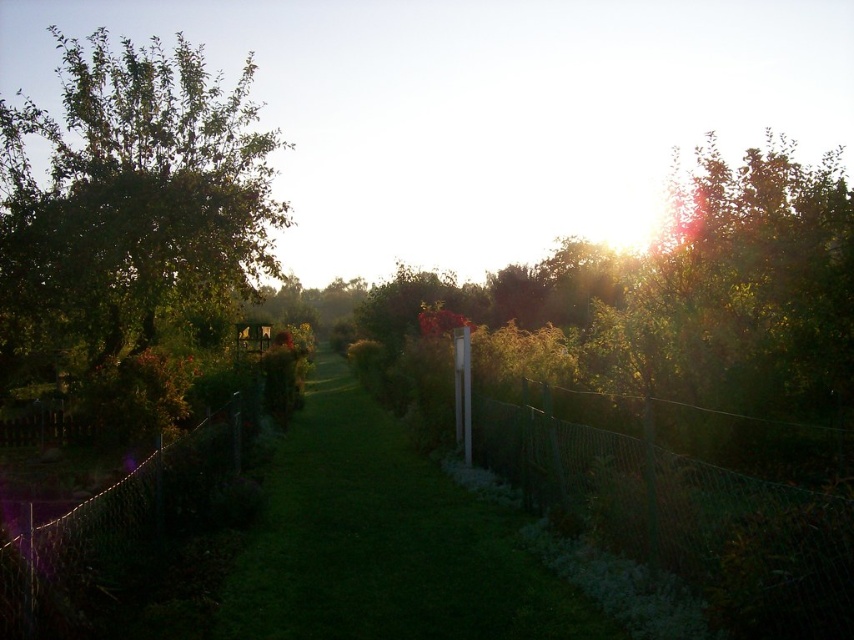
Image resolution: width=854 pixels, height=640 pixels. I want to click on green wire mesh fence at right, so click(x=686, y=518).

Between green wire mesh fence at right and wire mesh fence at left, which one has more height?

With more height is wire mesh fence at left.

The width and height of the screenshot is (854, 640). Describe the element at coordinates (686, 518) in the screenshot. I see `green wire mesh fence at right` at that location.

Identify the location of green wire mesh fence at right. This screenshot has width=854, height=640. (686, 518).

Is green grass at center wider than wire mesh fence at left?

Yes, green grass at center is wider than wire mesh fence at left.

Is point (431, 579) positioned before point (63, 538)?

No, it is behind (63, 538).

The image size is (854, 640). I want to click on green grass at center, so click(384, 541).

Consider the image. How distant is green leafy tree at left from green grass at center?

green leafy tree at left and green grass at center are 24.15 meters apart.

Can you confirm if green leafy tree at left is bigger than green grass at center?

Indeed, green leafy tree at left has a larger size compared to green grass at center.

Is point (183, 186) positioned before point (250, 628)?

No, it is not.

Find the location of a particular element. The image size is (854, 640). green leafy tree at left is located at coordinates (130, 200).